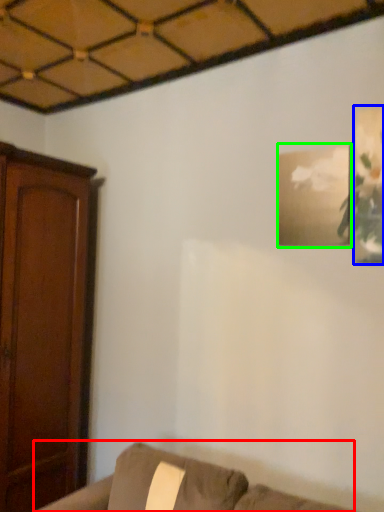
Question: Which object is the farthest from furniture (highlighted by a red box)? Choose among these: picture frame (highlighted by a blue box) or picture frame (highlighted by a green box).

Choices:
 (A) picture frame
 (B) picture frame

Answer: (A)